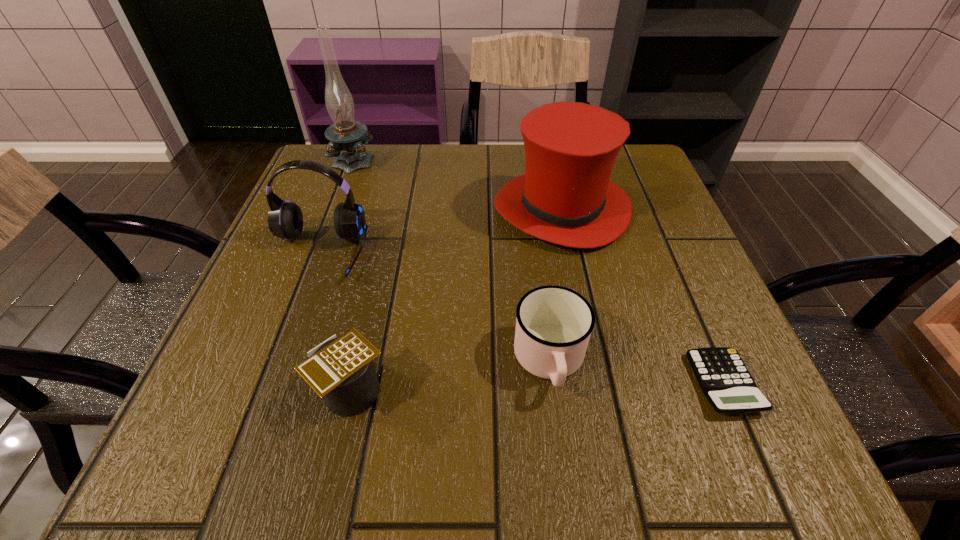
Identify the location of vacant area that lies between the hat and the left calculator. The width and height of the screenshot is (960, 540). (456, 300).

Find the location of a particular element. Image resolution: width=960 pixels, height=540 pixels. vacant area that lies between the hat and the headset is located at coordinates (440, 231).

At what (x,y) coordinates should I click in order to perform the action: click on vacant point located between the shorter calculator and the mug. Please return your answer as a coordinate pair (x, y). Looking at the image, I should click on (636, 372).

Find the location of `vacant space in between the mug and the right calculator`. vacant space in between the mug and the right calculator is located at coordinates (636, 372).

What are the coordinates of `blank region between the mug and the headset` in the screenshot? It's located at (434, 307).

What are the coordinates of `free spot between the headset and the mug` in the screenshot? It's located at (434, 307).

Find the location of a particular element. free area in between the shorter calculator and the mug is located at coordinates (636, 372).

Identify the location of object that stands as the second closest to the hat. This screenshot has height=540, width=960. (724, 379).

You are a GUI agent. You are given a task and a screenshot of the screen. Output one action in this format:
    pyautogui.click(x=<x>, y=<y>)
    Task: Click on the object that is the closest one to the mug
    The image size is (960, 540).
    Given the screenshot: What is the action you would take?
    pyautogui.click(x=724, y=379)